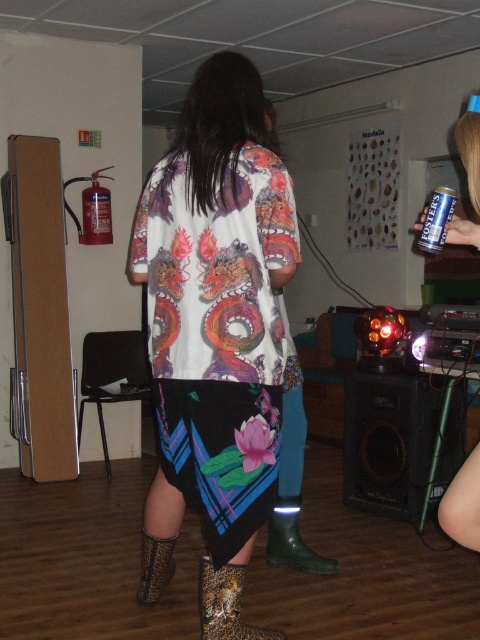
You are a fashion designer observing the leopard print fabric boot at lower center and the green rubber boot at lower center. Which boot is smaller in size?

The leopard print fabric boot at lower center has a smaller size compared to the green rubber boot at lower center.

You are taking a photo of the person wearing the dragon shirt and need to focus on two specific points in the image. The first point is at coordinates point (180, 214) and the second is at point (320, 556). Which point should you focus on first to ensure the subject is in sharp focus?

Point (180, 214) is closer to the camera than point (320, 556), so you should focus on point (180, 214) first to ensure the subject is in sharp focus.

You are a photographer trying to capture the printed fabric dress at center without the green rubber boot at lower center appearing in the shot. Can you adjust your angle to avoid the boot?

The printed fabric dress at center is positioned over the green rubber boot at lower center, so adjusting the angle might not be possible as the dress is covering the boot. The boot might still be visible underneath unless the dress is moved.